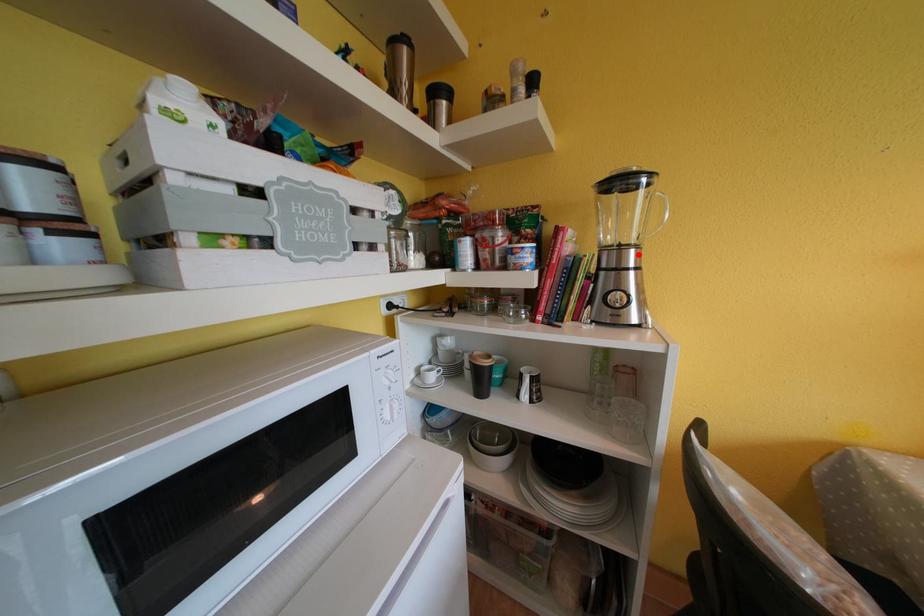
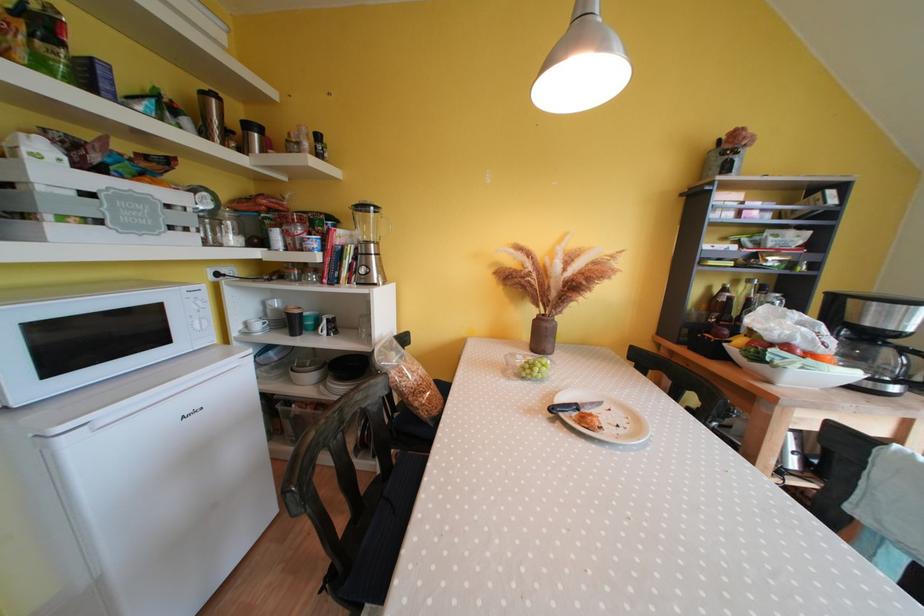
In the second image, find the point that corresponds to the highlighted location in the first image.

(379, 249)